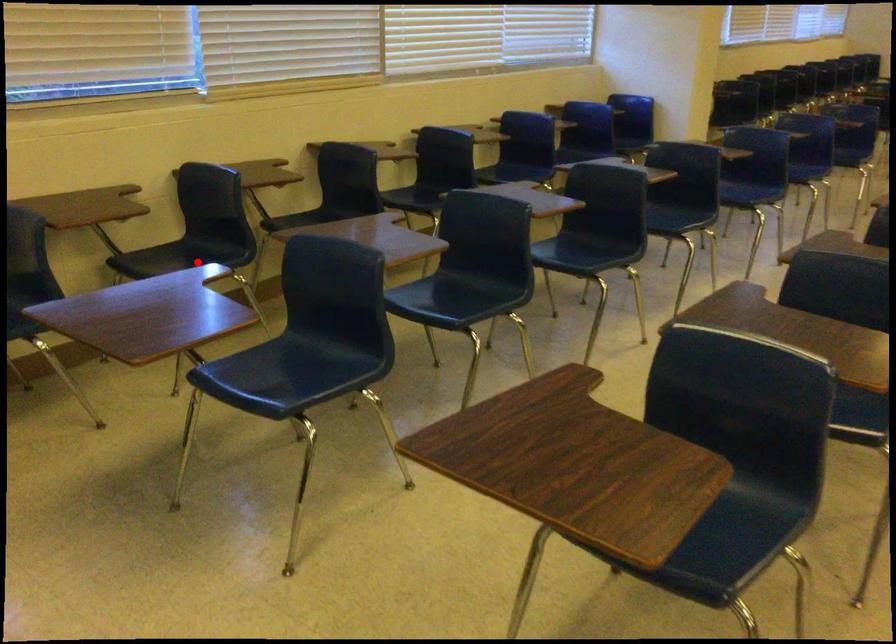
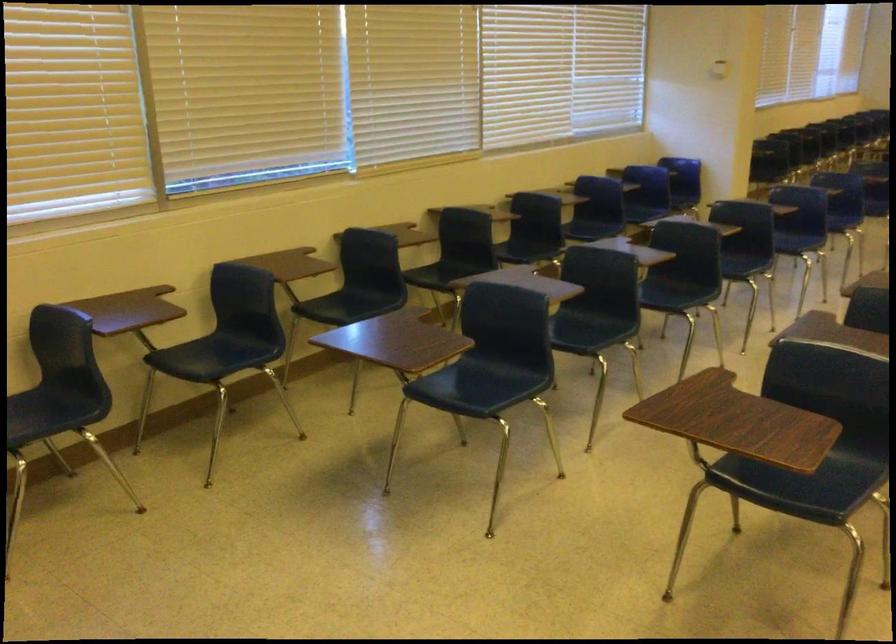
The point at the highlighted location is marked in the first image. Where is the corresponding point in the second image?

(359, 303)